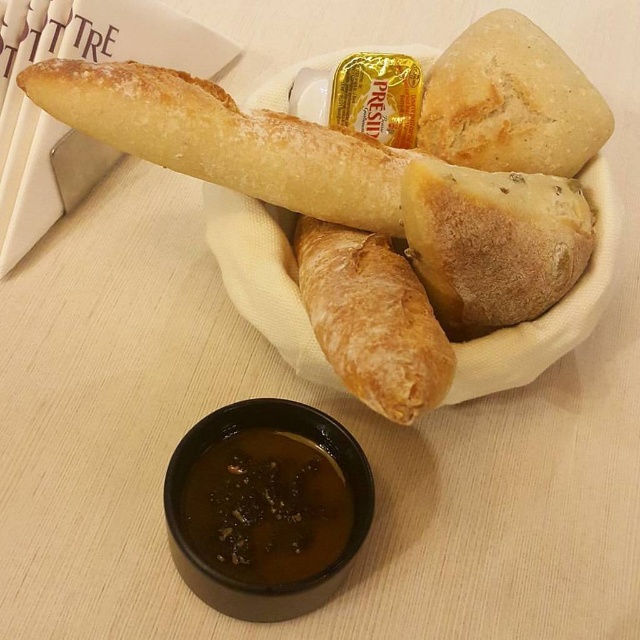
Which of these two, golden crusty baguette at center or golden brown crusty bread at center, stands taller?

golden brown crusty bread at center

Does golden crusty baguette at center have a larger size compared to golden brown crusty bread at center?

Yes.

Where is `golden crusty baguette at center`? golden crusty baguette at center is located at coordinates (225, 140).

Does golden crusty baguette at center have a greater height compared to brown crumbly bread at center?

No.

Based on the photo, between golden crusty baguette at center and brown crumbly bread at center, which one appears on the right side from the viewer's perspective?

Positioned to the right is brown crumbly bread at center.

The width and height of the screenshot is (640, 640). What do you see at coordinates (225, 140) in the screenshot?
I see `golden crusty baguette at center` at bounding box center [225, 140].

I want to click on golden crusty baguette at center, so click(x=225, y=140).

The width and height of the screenshot is (640, 640). Describe the element at coordinates (492, 243) in the screenshot. I see `brown crumbly bread at center` at that location.

Does brown crumbly bread at center appear on the right side of brown glossy sauce at lower center?

Yes, brown crumbly bread at center is to the right of brown glossy sauce at lower center.

What do you see at coordinates (492, 243) in the screenshot?
I see `brown crumbly bread at center` at bounding box center [492, 243].

In order to click on brown crumbly bread at center in this screenshot , I will do `click(492, 243)`.